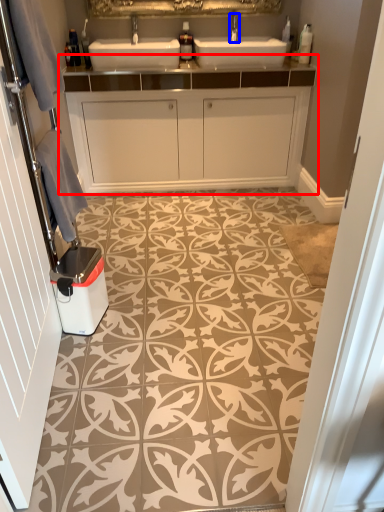
Question: Which object is closer to the camera taking this photo, bathroom cabinet (highlighted by a red box) or tap (highlighted by a blue box)?

Choices:
 (A) bathroom cabinet
 (B) tap

Answer: (A)